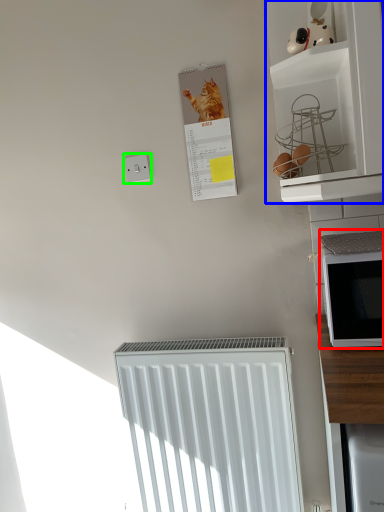
Question: Considering the real-world distances, which object is farthest from microwave oven (highlighted by a red box)? shelf (highlighted by a blue box) or electric outlet (highlighted by a green box)?

Choices:
 (A) shelf
 (B) electric outlet

Answer: (B)